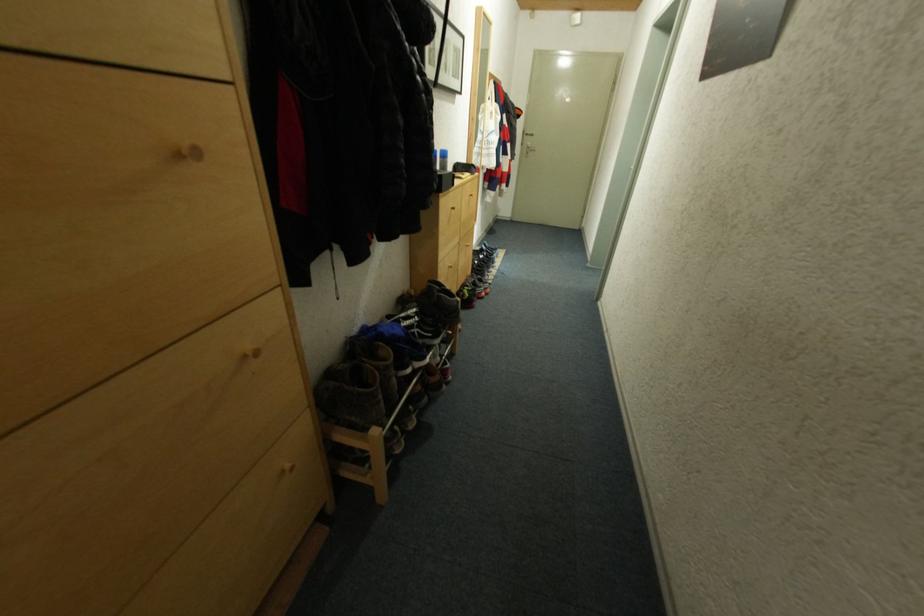
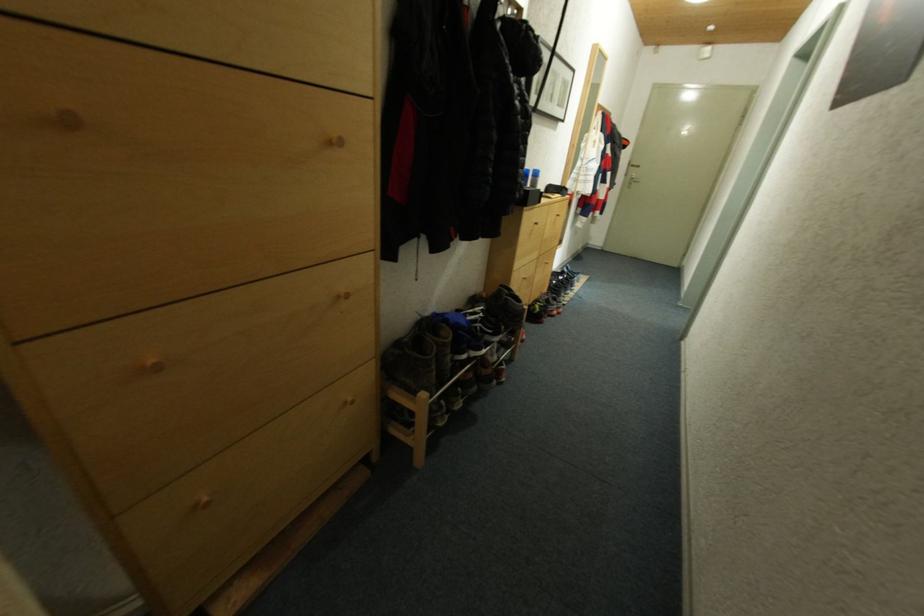
The images are taken continuously from a first-person perspective. In which direction are you moving?

The cameraman walked toward right, backward.